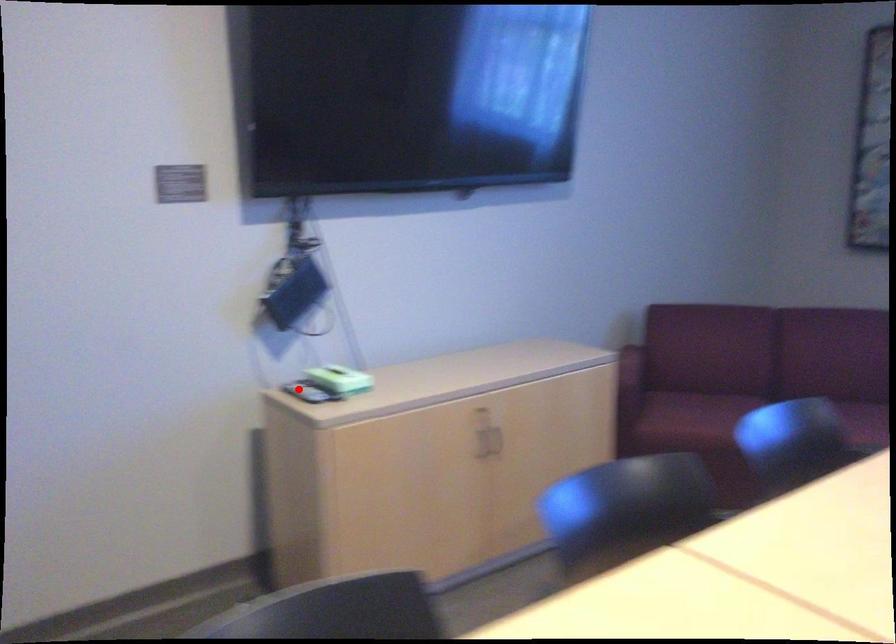
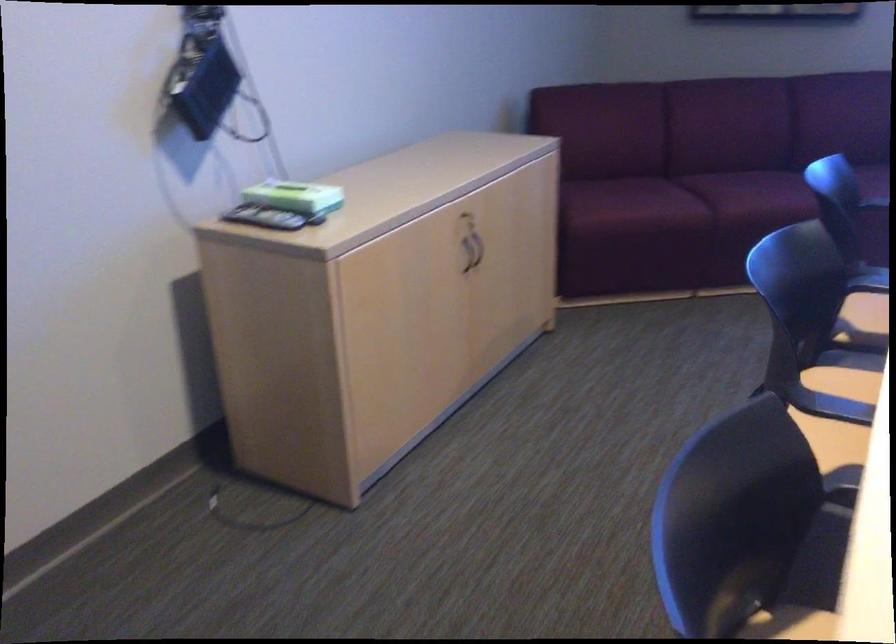
Locate, in the second image, the point that corresponds to the highlighted location in the first image.

(263, 218)